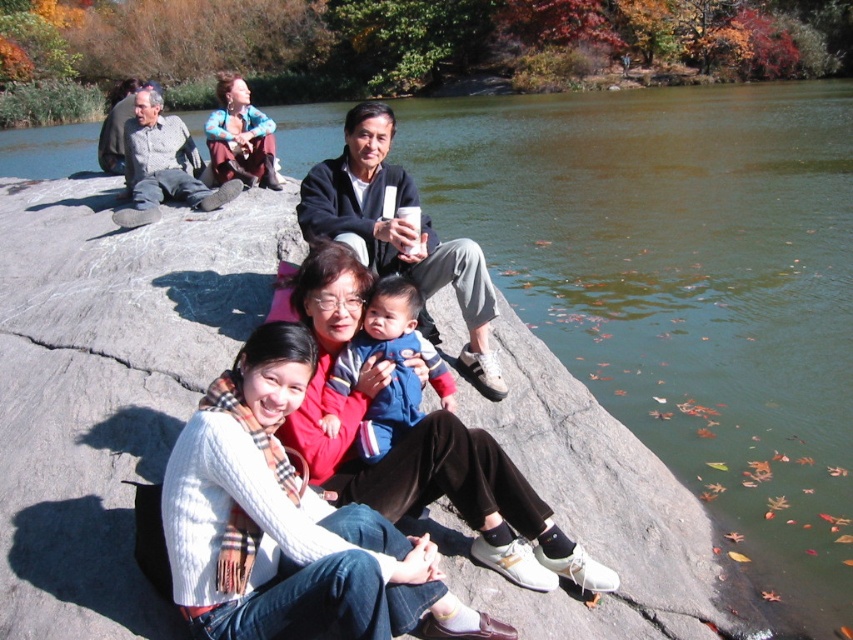
Can you confirm if white knit sweater at center is positioned above matte black jacket at center?

Actually, white knit sweater at center is below matte black jacket at center.

The image size is (853, 640). What do you see at coordinates (419, 448) in the screenshot?
I see `white knit sweater at center` at bounding box center [419, 448].

Identify the location of white knit sweater at center. The width and height of the screenshot is (853, 640). (419, 448).

Does white knit sweater at center have a lesser width compared to blue fleece jacket at center?

In fact, white knit sweater at center might be wider than blue fleece jacket at center.

Looking at this image, which is more to the right, white knit sweater at center or blue fleece jacket at center?

white knit sweater at center

Image resolution: width=853 pixels, height=640 pixels. I want to click on white knit sweater at center, so click(419, 448).

Which of these two, matte black jacket at center or blue fleece jacket at center, stands shorter?

With less height is blue fleece jacket at center.

The width and height of the screenshot is (853, 640). In order to click on matte black jacket at center in this screenshot , I will do `click(398, 232)`.